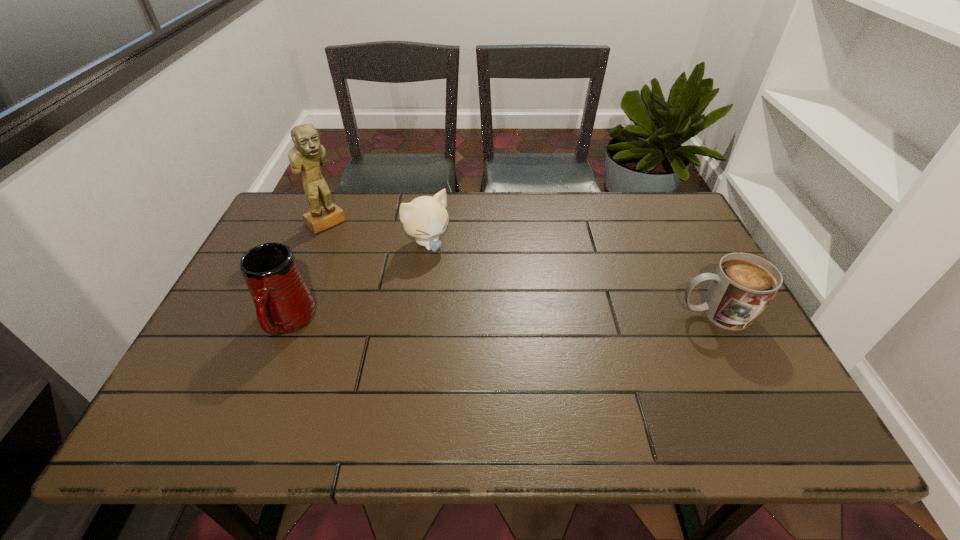
Locate an element on the screen. vacant space located on the face of the kitten is located at coordinates (524, 352).

You are a GUI agent. You are given a task and a screenshot of the screen. Output one action in this format:
    pyautogui.click(x=<x>, y=<y>)
    Task: Click on the free location located on the face of the kitten
    This screenshot has width=960, height=540.
    Given the screenshot: What is the action you would take?
    pyautogui.click(x=467, y=287)

Locate an element on the screen. This screenshot has width=960, height=540. vacant space situated on the front-facing side of the tallest object is located at coordinates (405, 289).

The image size is (960, 540). I want to click on free region located on the front-facing side of the tallest object, so click(x=415, y=298).

Locate an element on the screen. vacant region located 0.240m on the front-facing side of the tallest object is located at coordinates (383, 271).

The height and width of the screenshot is (540, 960). I want to click on kitten located at the far edge, so click(x=425, y=218).

Where is `figurine at the far edge`? The height and width of the screenshot is (540, 960). figurine at the far edge is located at coordinates (307, 154).

Identify the location of mug that is at the left edge. This screenshot has width=960, height=540. (284, 303).

Locate an element on the screen. figurine that is positioned at the left edge is located at coordinates (307, 154).

The height and width of the screenshot is (540, 960). In order to click on object present at the right edge in this screenshot , I will do `click(742, 286)`.